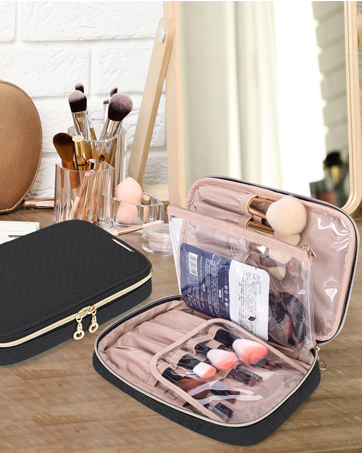
At what (x,y) coordinates should I click in order to perform the action: click on white brick. Please return your answer as a coordinate pair (x, y). Looking at the image, I should click on (77, 20), (64, 69), (110, 73), (46, 119), (58, 181), (143, 174), (2, 16).